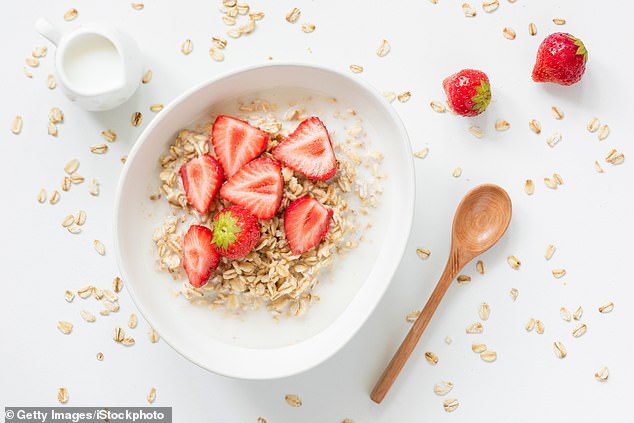
Where is `milk in cup`? The image size is (634, 423). milk in cup is located at coordinates (96, 56).